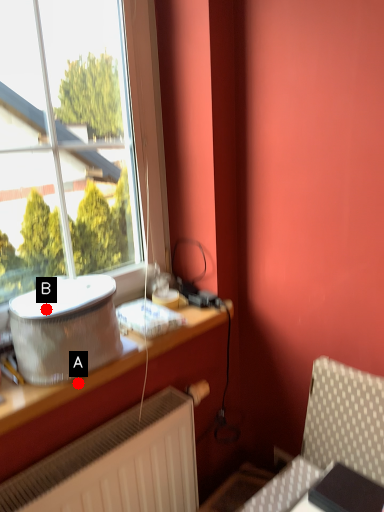
Question: Two points are circled on the image, labeled by A and B beside each circle. Which point is closer to the camera taking this photo?

Choices:
 (A) A is closer
 (B) B is closer

Answer: (B)